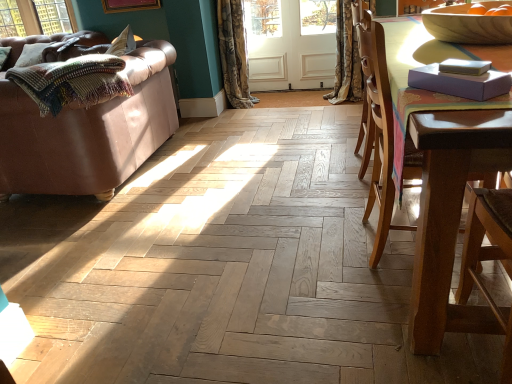
What are the coordinates of `empty space that is ontop of purple matte book at upper right (from a real-world perspective)` in the screenshot? It's located at (463, 63).